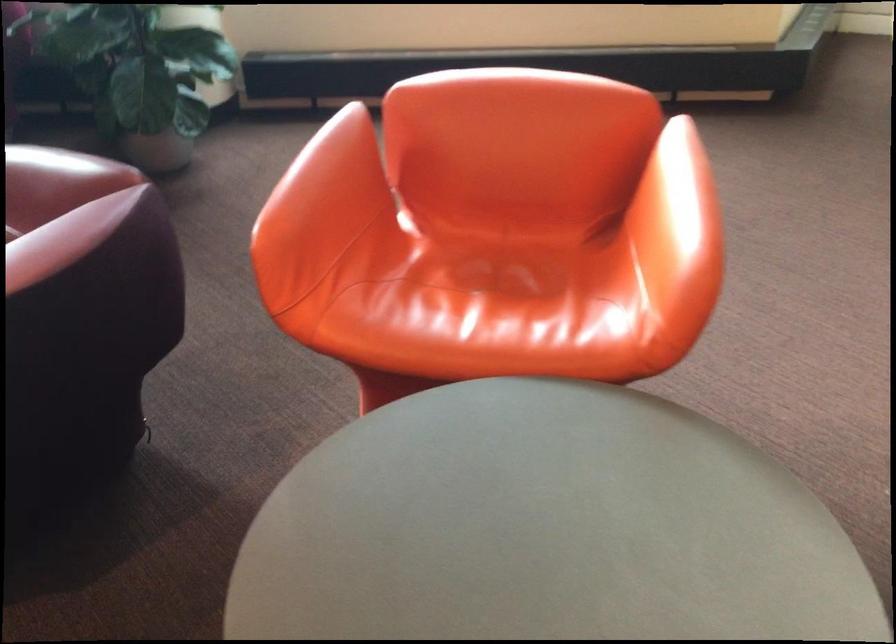
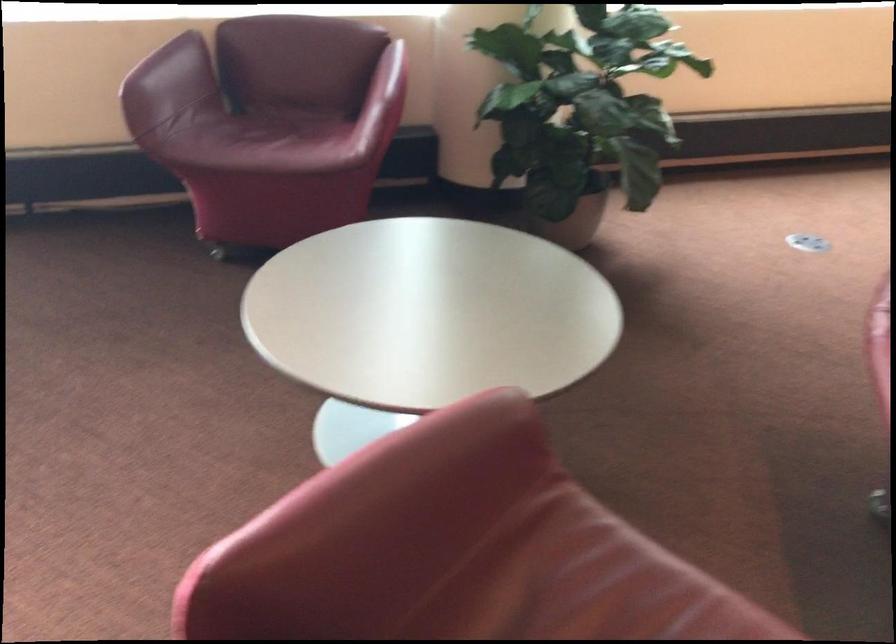
Question: In a continuous first-person perspective shot, in which direction is the camera moving?

Choices:
 (A) Left
 (B) Right
 (C) Forward
 (D) Backward

Answer: (A)